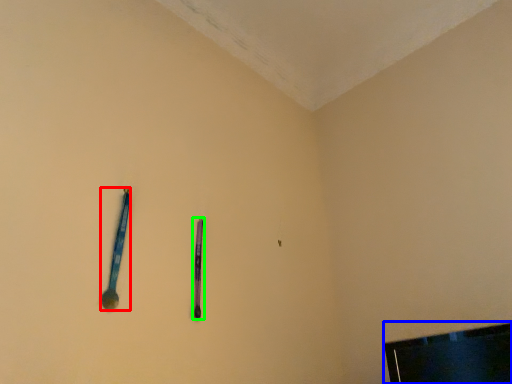
Question: Which object is positioned closest to spoon (highlighted by a red box)? Select from television (highlighted by a blue box) and writing (highlighted by a green box).

Choices:
 (A) television
 (B) writing

Answer: (B)